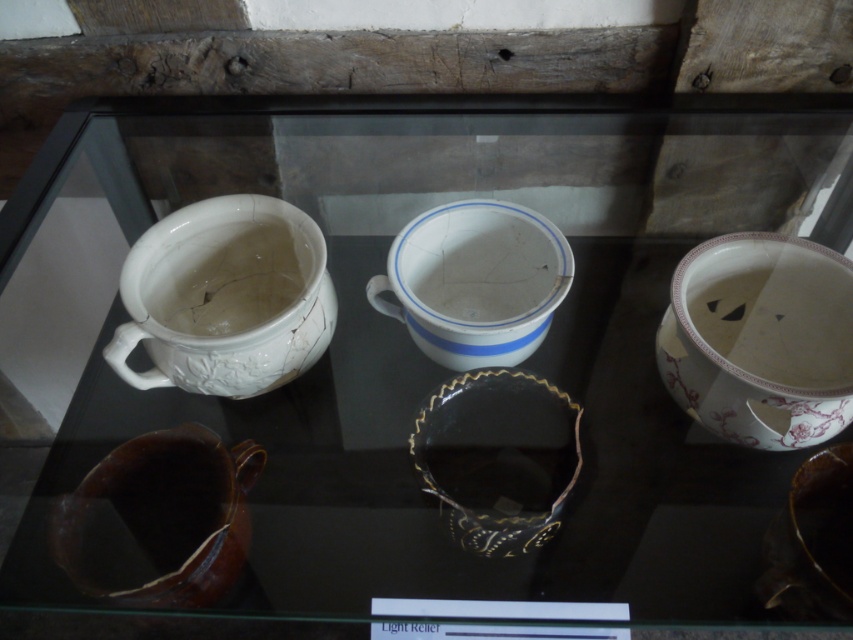
Describe the element at coordinates (160, 518) in the screenshot. I see `brown glazed pitcher at lower left` at that location.

Can you confirm if brown glazed pitcher at lower left is taller than white matte teapot at upper left?

Correct, brown glazed pitcher at lower left is much taller as white matte teapot at upper left.

Looking at this image, who is more distant from viewer, (97, 556) or (280, 284)?

Point (280, 284)

Where is `brown glazed pitcher at lower left`? This screenshot has height=640, width=853. brown glazed pitcher at lower left is located at coordinates [160, 518].

The height and width of the screenshot is (640, 853). What are the coordinates of `white glossy mug at upper left` in the screenshot? It's located at (225, 298).

Locate an element on the screen. The width and height of the screenshot is (853, 640). white glossy mug at upper left is located at coordinates (225, 298).

Can you confirm if white glossy mug at upper left is smaller than white glossy mug at center?

No, white glossy mug at upper left is not smaller than white glossy mug at center.

Who is shorter, white glossy mug at upper left or white glossy mug at center?

Standing shorter between the two is white glossy mug at center.

Which is in front, point (166, 321) or point (502, 310)?

Point (166, 321) is more forward.

In order to click on white glossy mug at upper left in this screenshot , I will do `click(225, 298)`.